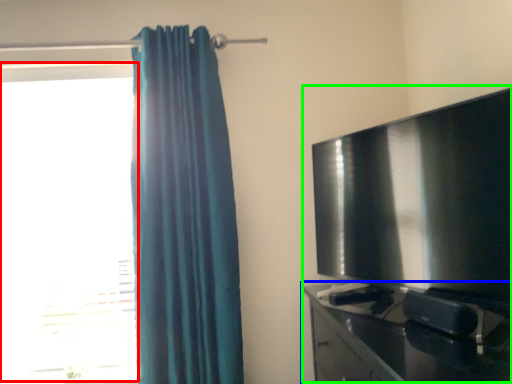
Question: Based on their relative distances, which object is nearer to window (highlighted by a red box)? Choose from furniture (highlighted by a blue box) and entertainment center (highlighted by a green box).

Choices:
 (A) furniture
 (B) entertainment center

Answer: (A)